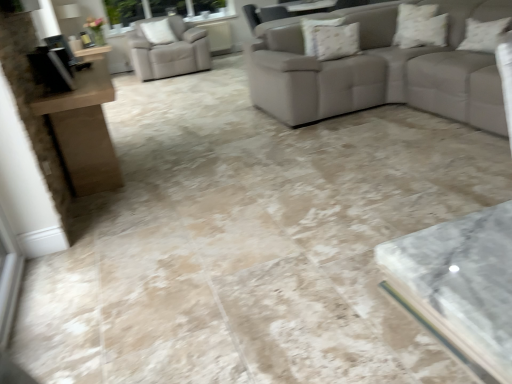
Question: Does beige leather armchair at upper left appear on the left side of floral fabric pillow at upper center, which ranks as the third pillow in right-to-left order?

Choices:
 (A) no
 (B) yes

Answer: (B)

Question: Can you confirm if beige leather armchair at upper left is bigger than floral fabric pillow at upper center, which ranks as the third pillow in right-to-left order?

Choices:
 (A) yes
 (B) no

Answer: (A)

Question: Considering the relative sizes of beige leather armchair at upper left and floral fabric pillow at upper center, arranged as the second pillow when viewed from the back, in the image provided, is beige leather armchair at upper left thinner than floral fabric pillow at upper center, arranged as the second pillow when viewed from the back,?

Choices:
 (A) no
 (B) yes

Answer: (B)

Question: Is beige leather armchair at upper left facing away from floral fabric pillow at upper center, the 3th pillow positioned from the top?

Choices:
 (A) yes
 (B) no

Answer: (B)

Question: Is beige leather armchair at upper left outside of floral fabric pillow at upper center, arranged as the second pillow when viewed from the back?

Choices:
 (A) no
 (B) yes

Answer: (B)

Question: In the image, is white textured pillow at upper left, arranged as the fourth pillow when viewed from the front, on the left side or the right side of white textured pillow at upper right, which ranks as the second pillow in front-to-back order?

Choices:
 (A) right
 (B) left

Answer: (B)

Question: Relative to white textured pillow at upper right, the 2th pillow viewed from the right, is white textured pillow at upper left, positioned as the 1th pillow in left-to-right order, in front or behind?

Choices:
 (A) front
 (B) behind

Answer: (B)

Question: From their relative heights in the image, would you say white textured pillow at upper left, placed as the fourth pillow when sorted from bottom to top, is taller or shorter than white textured pillow at upper right, which ranks as the second pillow in front-to-back order?

Choices:
 (A) short
 (B) tall

Answer: (B)

Question: Is point (160, 21) closer or farther from the camera than point (414, 36)?

Choices:
 (A) closer
 (B) farther

Answer: (B)

Question: Considering the positions of white textured pillow at upper left, the fourth pillow positioned from the right, and white textured pillow at upper right, the fourth pillow positioned from the top, in the image, is white textured pillow at upper left, the fourth pillow positioned from the right, bigger or smaller than white textured pillow at upper right, the fourth pillow positioned from the top,?

Choices:
 (A) big
 (B) small

Answer: (A)

Question: From the image's perspective, is white textured pillow at upper left, placed as the fourth pillow when sorted from bottom to top, positioned above or below white textured pillow at upper right, the fourth pillow positioned from the left?

Choices:
 (A) below
 (B) above

Answer: (B)

Question: Is white textured pillow at upper left, the first pillow in the back-to-front sequence, in front of or behind white textured pillow at upper right, the 4th pillow positioned from the back, in the image?

Choices:
 (A) front
 (B) behind

Answer: (B)

Question: Is white textured pillow at upper left, the fourth pillow positioned from the right, taller or shorter than white textured pillow at upper right, positioned as the first pillow in front-to-back order?

Choices:
 (A) short
 (B) tall

Answer: (B)

Question: Considering the positions of white textured pillow at upper right, which appears as the 1th pillow when viewed from the right, and white textured pillow at upper left, arranged as the fourth pillow when viewed from the front, in the image, is white textured pillow at upper right, which appears as the 1th pillow when viewed from the right, bigger or smaller than white textured pillow at upper left, arranged as the fourth pillow when viewed from the front,?

Choices:
 (A) big
 (B) small

Answer: (B)

Question: Is white textured pillow at upper right, the 4th pillow positioned from the back, inside the boundaries of white textured pillow at upper left, which is the first pillow from top to bottom, or outside?

Choices:
 (A) outside
 (B) inside

Answer: (A)